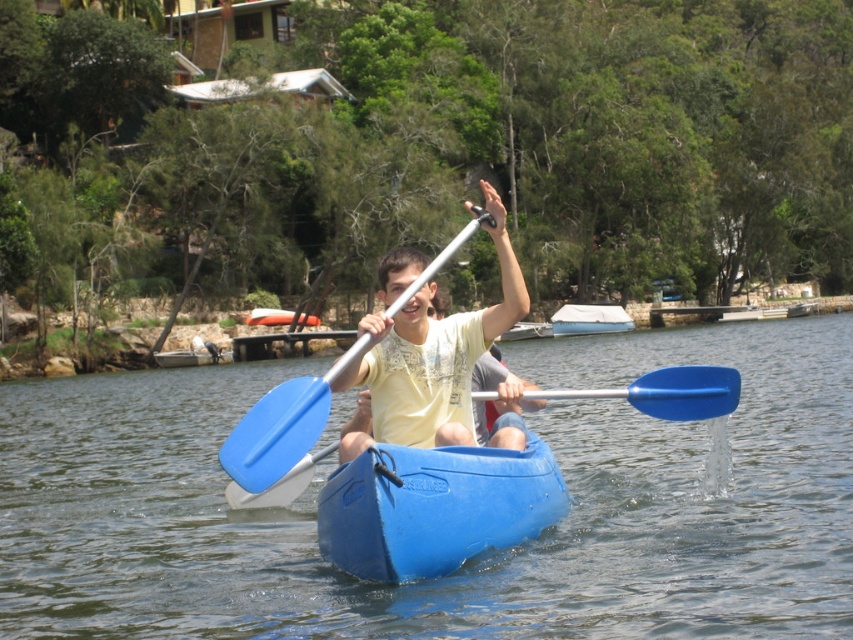
Is clear water at center above matte yellow t-shirt at center?

Actually, clear water at center is below matte yellow t-shirt at center.

At what (x,y) coordinates should I click in order to perform the action: click on clear water at center. Please return your answer as a coordinate pair (x, y). The image size is (853, 640). Looking at the image, I should click on (467, 563).

At what (x,y) coordinates should I click in order to perform the action: click on clear water at center. Please return your answer as a coordinate pair (x, y). Looking at the image, I should click on (467, 563).

Locate an element on the screen. The width and height of the screenshot is (853, 640). clear water at center is located at coordinates (467, 563).

Locate an element on the screen. blue plastic canoe at center is located at coordinates (434, 506).

Is blue plastic canoe at center thinner than matte yellow t-shirt at center?

No.

Where is `blue plastic canoe at center`? This screenshot has width=853, height=640. blue plastic canoe at center is located at coordinates (434, 506).

Who is more forward, (233, 404) or (570, 312)?

Point (233, 404) is more forward.

Consider the image. Is clear water at center smaller than white canvas boat at center?

No.

Describe the element at coordinates (467, 563) in the screenshot. I see `clear water at center` at that location.

Where is `clear water at center`? clear water at center is located at coordinates (467, 563).